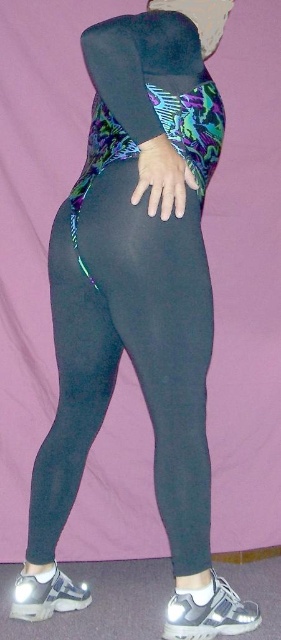
You are a photographer setting up a shoot. You need to adjust the lighting so that the matte black hand at center is visible in front of the black matte leggings at center. According to the scene description, is the hand currently visible in front of the leggings?

The matte black hand at center is behind black matte leggings at center, so it is not visible in front of them. Adjust the position or lighting to make the hand appear in front.

You are a photographer adjusting your camera to focus on the person in the image. You notice two points marked on the screen at coordinates point (139, 212) and point (148, 188). Which point should you focus on first if you want to capture the person clearly, considering their spatial relationship?

Point (139, 212) is in front of point (148, 188), so you should focus on point (139, 212) first to capture the person clearly.

You are a photographer setting up for a photoshoot. The subject is wearing black matte leggings at center. To ensure the leggings are in focus, you need to adjust your camera to the correct distance. What should the camera distance be set to?

The black matte leggings at center is 4.49 feet from camera, so the camera should be set to 4.49 feet distance to ensure proper focus.